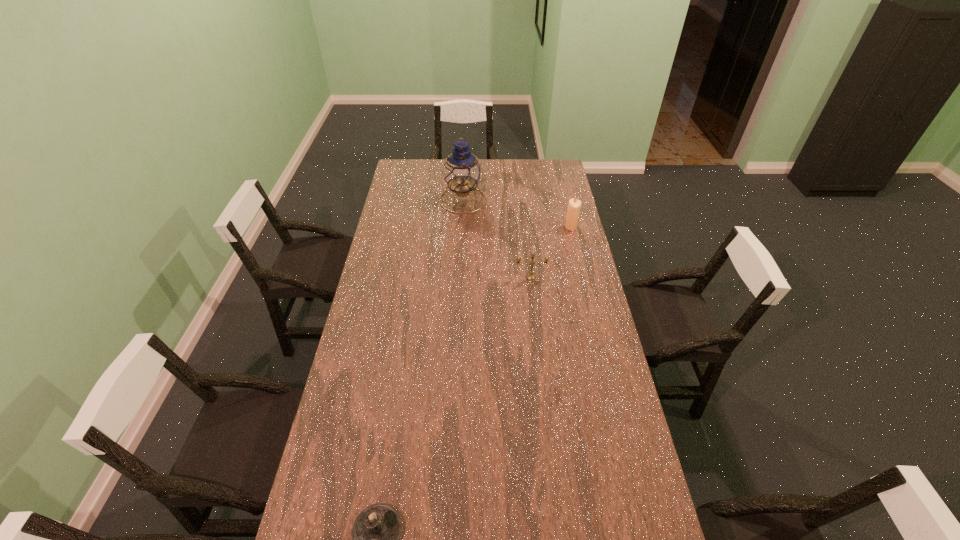
Locate an element on the screen. The height and width of the screenshot is (540, 960). vacant space that satisfies the following two spatial constraints: 1. on the front-facing side of the tallest object; 2. on the right side of the third object from left to right is located at coordinates pos(460,277).

Where is `vacant space that satisfies the following two spatial constraints: 1. on the front-facing side of the farthest object; 2. on the left side of the rightmost candle`? The image size is (960, 540). vacant space that satisfies the following two spatial constraints: 1. on the front-facing side of the farthest object; 2. on the left side of the rightmost candle is located at coordinates (462, 227).

Find the location of a particular element. Image resolution: width=960 pixels, height=540 pixels. vacant area that satisfies the following two spatial constraints: 1. on the front-facing side of the tallest object; 2. on the left side of the second nearest candle is located at coordinates (460, 277).